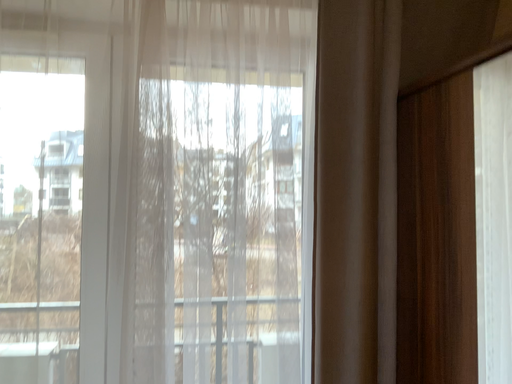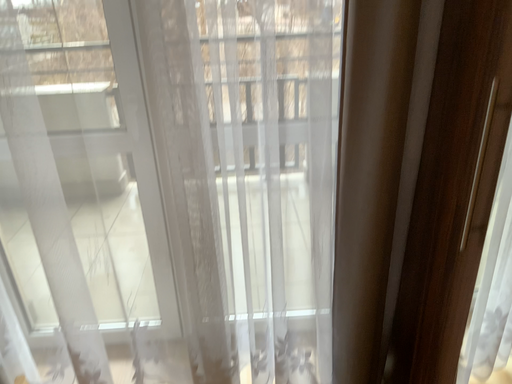
Question: How did the camera likely rotate when shooting the video?

Choices:
 (A) rotated left
 (B) rotated right

Answer: (A)